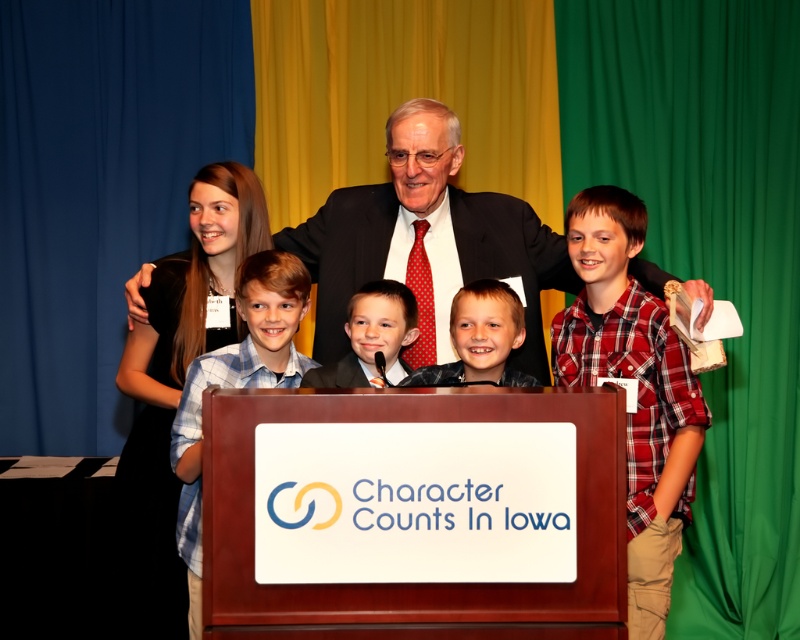
You are a photographer at the event and need to capture a photo of the smooth black suit at center without the red plaid shirt at right blocking it. How can you adjust your position to achieve this?

Move to a position where the smooth black suit at center is no longer behind the red plaid shirt at right. Since the red plaid shirt at right is in front of the smooth black suit at center, moving to the left side would place the red plaid shirt at right behind the smooth black suit at center, allowing an unobstructed view.

You are attending the Character Counts In Iowa event and notice two people in the image. One is wearing a red plaid shirt at right and the other a smooth black suit at center. Based on their positions in the scene, which person is standing closer to the front?

The red plaid shirt at right is located below the smooth black suit at center, meaning the red plaid shirt at right is positioned closer to the front of the scene.